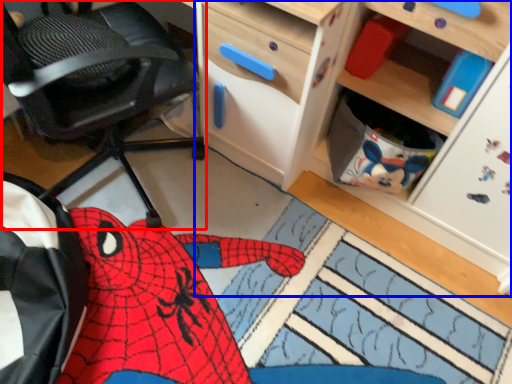
Question: Among these objects, which one is nearest to the camera, chair (highlighted by a red box) or cabinetry (highlighted by a blue box)?

Choices:
 (A) chair
 (B) cabinetry

Answer: (A)